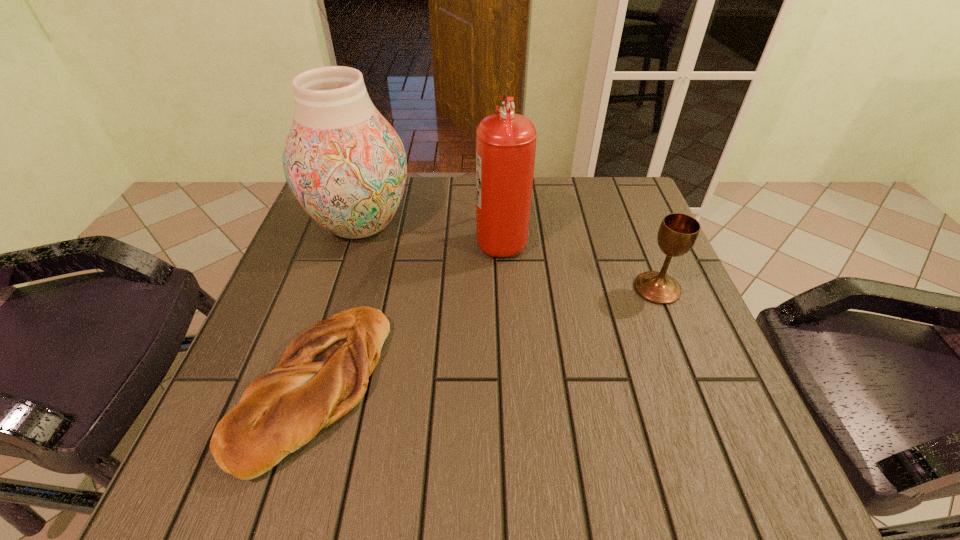
Locate an element on the screen. free spot between the vase and the third object from left to right is located at coordinates pos(431,231).

Locate an element on the screen. The image size is (960, 540). free space between the shortest object and the vase is located at coordinates (338, 305).

Identify the location of free space between the fire extinguisher and the vase. This screenshot has height=540, width=960. (431, 231).

Where is `empty space that is in between the shortest object and the second nearest object`? empty space that is in between the shortest object and the second nearest object is located at coordinates (486, 337).

This screenshot has height=540, width=960. I want to click on the third closest object to the vase, so click(678, 233).

Identify the location of the second closest object to the nearest object. 505,142.

The width and height of the screenshot is (960, 540). Find the location of `vacant point that satisfies the following two spatial constraints: 1. on the instruction side of the second nearest object; 2. on the right side of the second object from right to left`. vacant point that satisfies the following two spatial constraints: 1. on the instruction side of the second nearest object; 2. on the right side of the second object from right to left is located at coordinates (504, 288).

I want to click on free location that satisfies the following two spatial constraints: 1. on the instruction side of the second nearest object; 2. on the left side of the third object from left to right, so click(504, 288).

Identify the location of vacant point that satisfies the following two spatial constraints: 1. on the instruction side of the fire extinguisher; 2. on the back side of the rightmost object. (504, 288).

Identify the location of vacant space that satisfies the following two spatial constraints: 1. on the instruction side of the third object from left to right; 2. on the front side of the nearest object. The height and width of the screenshot is (540, 960). (509, 386).